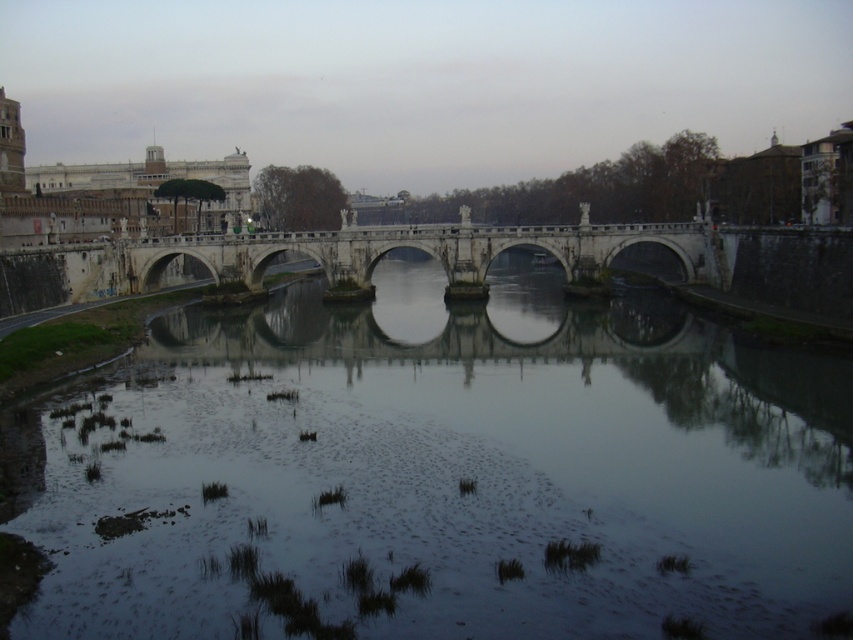
In the scene shown: Does dark reflective water at center appear under stone bridge at center?

Indeed, dark reflective water at center is positioned under stone bridge at center.

Which is more to the left, dark reflective water at center or stone bridge at center?

stone bridge at center

You are a GUI agent. You are given a task and a screenshot of the screen. Output one action in this format:
    pyautogui.click(x=<x>, y=<y>)
    Task: Click on the dark reflective water at center
    
    Given the screenshot: What is the action you would take?
    pyautogui.click(x=445, y=474)